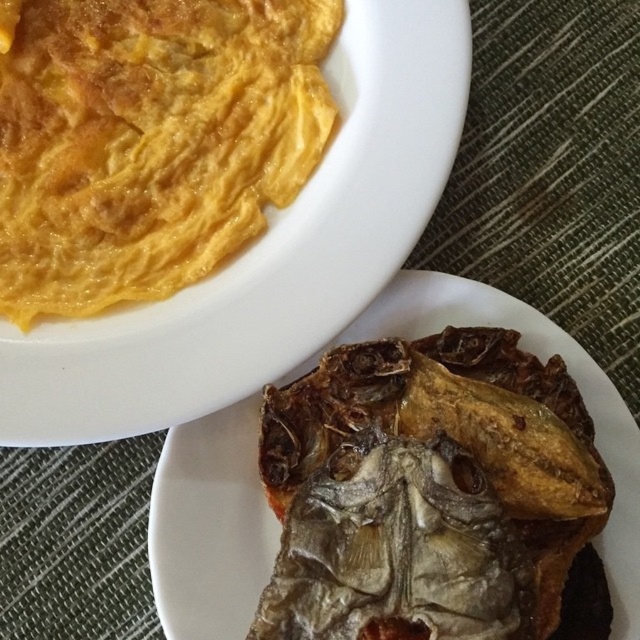
You are a food delivery robot that needs to pick up the brown crispy fish at lower right. The robot has a 0.5 meter reach. The point where you can grab the fish is at coordinate point (428, 490). Can you reach it?

The point (428, 490) corresponds to the brown crispy fish at lower right, so yes, the robot can reach it since the coordinate is within the robot reach of 0.5 meters.

You are standing in front of a table with two food plates. There are two points marked on the table surface. The first point is at coordinate point (342, 625) and the second is at point (56, 284). If you want to reach the point that is closer to you, which coordinate should you aim for?

Point (342, 625) is closer to the camera than point (56, 284), so you should aim for point (342, 625).

You are a food delivery person who needs to stack these two dishes on a tray. The yellow soft omelette at upper left is fragile and can only be placed on top of the brown crispy fish at lower right if the fish is thicker. Can you safely stack them?

The brown crispy fish at lower right is thinner than the yellow soft omelette at upper left. Therefore, the omelette cannot be placed on top of the fish since the fish is not thick enough to support it. You should place the fish on top of the omelette instead to ensure stability.